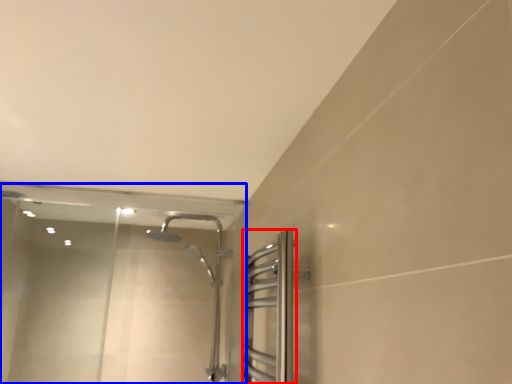
Question: Which object appears farthest to the camera in this image, screen door (highlighted by a red box) or glass door (highlighted by a blue box)?

Choices:
 (A) screen door
 (B) glass door

Answer: (B)